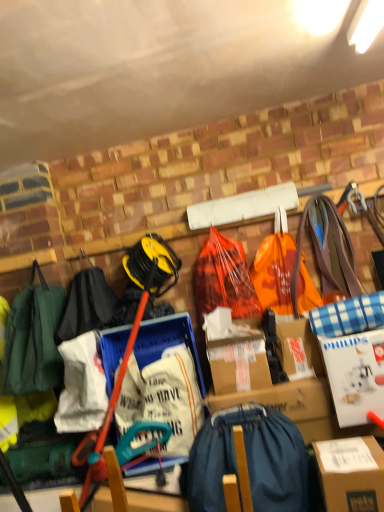
Question: Is brown cardboard box at lower right in front of orange plastic grocery bag at center, placed as the second grocery bag when sorted from left to right?

Choices:
 (A) no
 (B) yes

Answer: (B)

Question: Does brown cardboard box at lower right appear on the left side of orange plastic grocery bag at center, the 1th grocery bag in the right-to-left sequence?

Choices:
 (A) no
 (B) yes

Answer: (A)

Question: Is there a large distance between brown cardboard box at lower right and orange plastic grocery bag at center, the 1th grocery bag in the right-to-left sequence?

Choices:
 (A) yes
 (B) no

Answer: (B)

Question: Can orange plastic grocery bag at center, placed as the second grocery bag when sorted from left to right, be found inside brown cardboard box at lower right?

Choices:
 (A) no
 (B) yes

Answer: (A)

Question: Is brown cardboard box at lower right positioned behind orange plastic grocery bag at center, the 1th grocery bag in the right-to-left sequence?

Choices:
 (A) yes
 (B) no

Answer: (B)

Question: Considering the relative sizes of brown cardboard box at lower right and orange plastic grocery bag at center, placed as the second grocery bag when sorted from left to right, in the image provided, is brown cardboard box at lower right thinner than orange plastic grocery bag at center, placed as the second grocery bag when sorted from left to right,?

Choices:
 (A) no
 (B) yes

Answer: (A)

Question: Is orange plastic bag at center, marked as the 1th grocery bag in a left-to-right arrangement, positioned beyond the bounds of white cardboard box at right?

Choices:
 (A) yes
 (B) no

Answer: (A)

Question: Does orange plastic bag at center, the 2th grocery bag when ordered from right to left, turn towards white cardboard box at right?

Choices:
 (A) yes
 (B) no

Answer: (B)

Question: Does orange plastic bag at center, the 2th grocery bag when ordered from right to left, have a smaller size compared to white cardboard box at right?

Choices:
 (A) no
 (B) yes

Answer: (A)

Question: Does orange plastic bag at center, the 2th grocery bag when ordered from right to left, have a lesser width compared to white cardboard box at right?

Choices:
 (A) no
 (B) yes

Answer: (B)

Question: Considering the relative positions of orange plastic bag at center, marked as the 1th grocery bag in a left-to-right arrangement, and white cardboard box at right in the image provided, is orange plastic bag at center, marked as the 1th grocery bag in a left-to-right arrangement, to the left of white cardboard box at right from the viewer's perspective?

Choices:
 (A) no
 (B) yes

Answer: (B)

Question: Is white cardboard box at right inside orange plastic bag at center, the 2th grocery bag when ordered from right to left?

Choices:
 (A) no
 (B) yes

Answer: (A)

Question: Is orange plastic bag at center, the 2th grocery bag when ordered from right to left, with orange plastic grocery bag at center, placed as the second grocery bag when sorted from left to right?

Choices:
 (A) no
 (B) yes

Answer: (A)